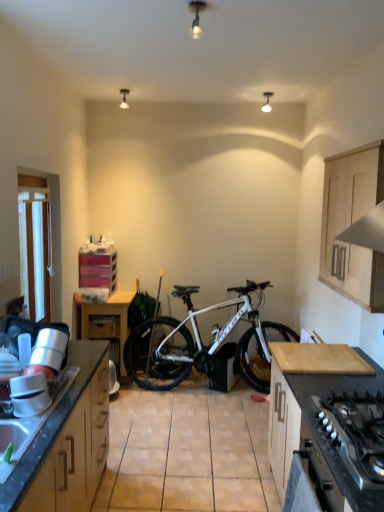
Question: From a real-world perspective, is light wood cabinet at upper right, the fourth cabinetry from the left, on top of white fabric at left?

Choices:
 (A) yes
 (B) no

Answer: (A)

Question: Is light wood cabinet at upper right, the 3th cabinetry in the back-to-front sequence, taller than white fabric at left?

Choices:
 (A) no
 (B) yes

Answer: (B)

Question: Is light wood cabinet at upper right, which is the first cabinetry from right to left, wider than white fabric at left?

Choices:
 (A) no
 (B) yes

Answer: (B)

Question: Is light wood cabinet at upper right, the fourth cabinetry from the left, next to white fabric at left?

Choices:
 (A) yes
 (B) no

Answer: (B)

Question: Is light wood cabinet at upper right, the 3th cabinetry in the back-to-front sequence, further to the viewer compared to white fabric at left?

Choices:
 (A) no
 (B) yes

Answer: (A)

Question: Can white fabric at left be found inside light wood cabinet at upper right, the 2th cabinetry in the front-to-back sequence?

Choices:
 (A) yes
 (B) no

Answer: (B)

Question: Is light wood cabinet at upper right, the fourth cabinetry from the left, at the left side of granite gray sink at lower left?

Choices:
 (A) yes
 (B) no

Answer: (B)

Question: Is light wood cabinet at upper right, the 2th cabinetry in the front-to-back sequence, located outside granite gray sink at lower left?

Choices:
 (A) no
 (B) yes

Answer: (B)

Question: Does light wood cabinet at upper right, the 3th cabinetry in the back-to-front sequence, have a larger size compared to granite gray sink at lower left?

Choices:
 (A) yes
 (B) no

Answer: (A)

Question: Does light wood cabinet at upper right, the fourth cabinetry from the left, have a lesser height compared to granite gray sink at lower left?

Choices:
 (A) no
 (B) yes

Answer: (A)

Question: Considering the relative sizes of light wood cabinet at upper right, the 3th cabinetry in the back-to-front sequence, and granite gray sink at lower left in the image provided, is light wood cabinet at upper right, the 3th cabinetry in the back-to-front sequence, wider than granite gray sink at lower left?

Choices:
 (A) yes
 (B) no

Answer: (B)

Question: From a real-world perspective, is light wood cabinet at upper right, which is the first cabinetry from right to left, positioned under granite gray sink at lower left based on gravity?

Choices:
 (A) no
 (B) yes

Answer: (A)

Question: Is pink plastic drawers at center left, the 1th cabinetry viewed from the back, completely or partially outside of light wood cabinet at upper right, which is the first cabinetry from right to left?

Choices:
 (A) yes
 (B) no

Answer: (A)